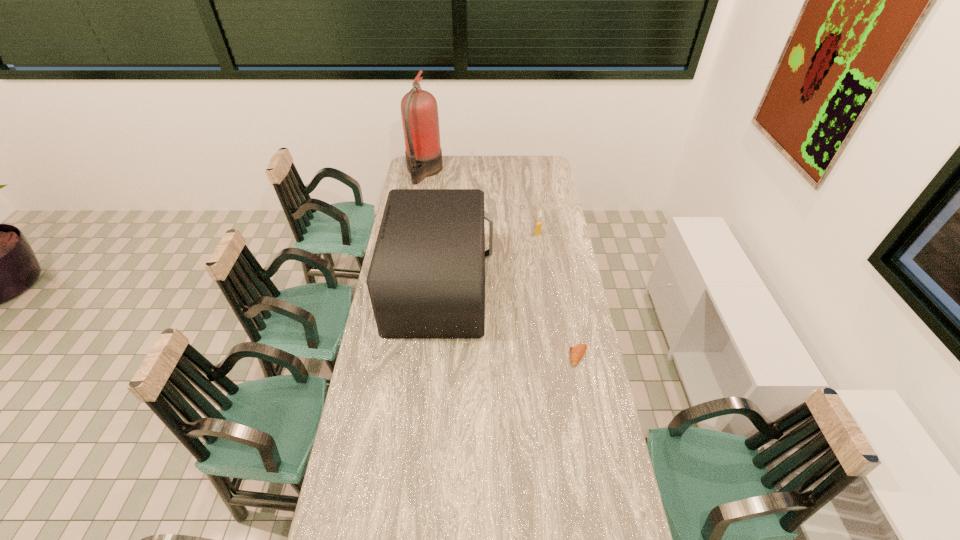
Identify the location of vacant region located 0.140m on the front of the second object from right to left. The height and width of the screenshot is (540, 960). (540, 255).

You are a GUI agent. You are given a task and a screenshot of the screen. Output one action in this format:
    pyautogui.click(x=<x>, y=<y>)
    Task: Click on the vacant region located 0.230m on the front of the rightmost object
    
    Given the screenshot: What is the action you would take?
    pyautogui.click(x=592, y=428)

At what (x,y) coordinates should I click in order to perform the action: click on object at the far edge. Please return your answer as a coordinate pair (x, y). Looking at the image, I should click on (419, 110).

The height and width of the screenshot is (540, 960). In order to click on fire extinguisher that is at the left edge in this screenshot , I will do `click(419, 110)`.

Where is `microwave oven at the left edge`? The height and width of the screenshot is (540, 960). microwave oven at the left edge is located at coordinates (426, 280).

Identify the location of candle that is positioned at the right edge. The width and height of the screenshot is (960, 540). (538, 224).

The width and height of the screenshot is (960, 540). I want to click on crescent roll positioned at the right edge, so click(577, 352).

Where is `object that is at the far left corner`? The image size is (960, 540). object that is at the far left corner is located at coordinates (419, 110).

This screenshot has width=960, height=540. In the image, there is a desktop. Find the location of `vacant space at the left edge`. vacant space at the left edge is located at coordinates [329, 535].

Locate an element on the screen. The height and width of the screenshot is (540, 960). blank space at the right edge is located at coordinates (543, 215).